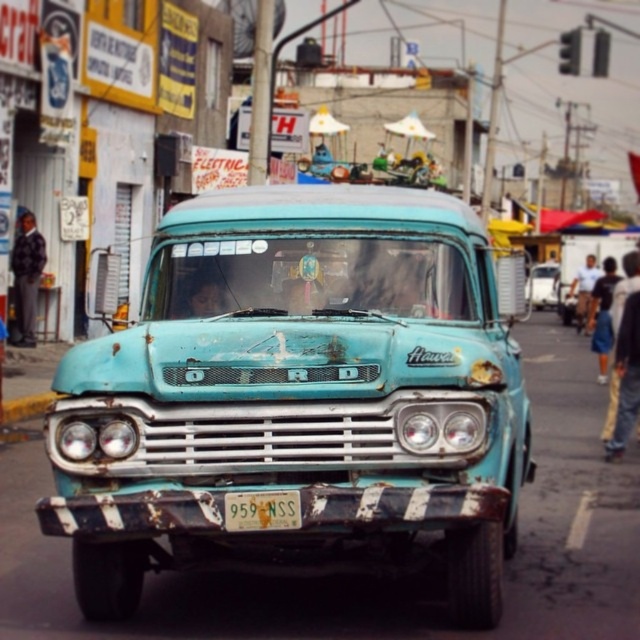
Which is below, rusty teal pickup truck at center or yellow matte license plate at center?

Positioned lower is yellow matte license plate at center.

Does rusty teal pickup truck at center appear on the right side of yellow matte license plate at center?

Yes, rusty teal pickup truck at center is to the right of yellow matte license plate at center.

This screenshot has height=640, width=640. Describe the element at coordinates (296, 396) in the screenshot. I see `rusty teal pickup truck at center` at that location.

I want to click on rusty teal pickup truck at center, so click(x=296, y=396).